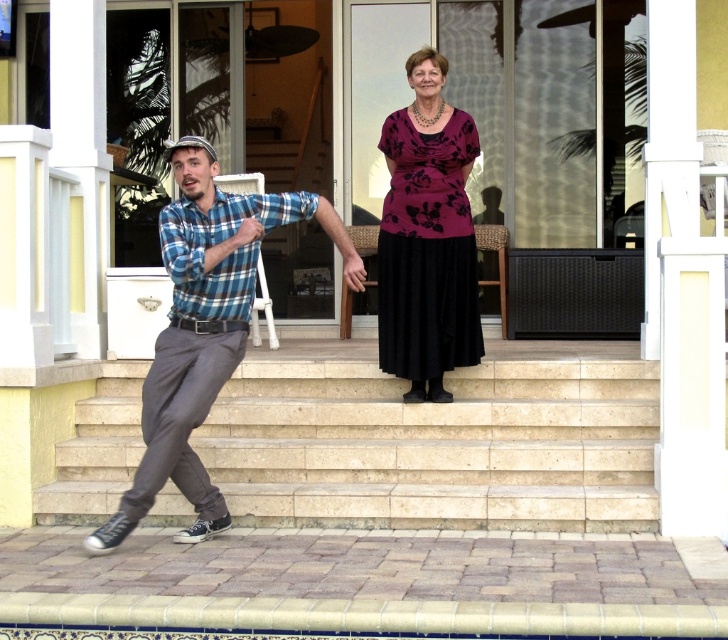
Question: Is purple floral fabric dress at center closer to camera compared to blue plaid shirt at lower left?

Choices:
 (A) no
 (B) yes

Answer: (A)

Question: Can you confirm if beige stone stairs at center is wider than blue plaid shirt at left?

Choices:
 (A) yes
 (B) no

Answer: (A)

Question: Which is farther from the purple floral fabric dress at center?

Choices:
 (A) blue plaid shirt at lower left
 (B) beige stone stairs at center

Answer: (A)

Question: Which object is closer to the camera taking this photo?

Choices:
 (A) blue plaid shirt at left
 (B) purple floral fabric dress at center
 (C) beige stone stairs at center
 (D) blue plaid shirt at lower left

Answer: (D)

Question: Is purple floral fabric dress at center below blue plaid shirt at lower left?

Choices:
 (A) yes
 (B) no

Answer: (B)

Question: Among these points, which one is nearest to the camera?

Choices:
 (A) (223, 372)
 (B) (526, 493)
 (C) (384, 202)

Answer: (A)